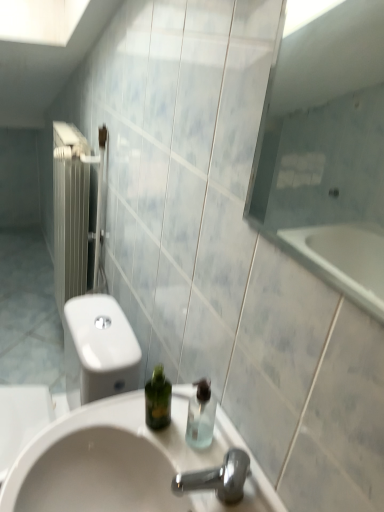
Question: Is white glossy sink at center at the right side of transparent glass shower at right?

Choices:
 (A) yes
 (B) no

Answer: (B)

Question: From a real-world perspective, does white glossy sink at center stand above transparent glass shower at right?

Choices:
 (A) yes
 (B) no

Answer: (B)

Question: Is white glossy sink at center aimed at transparent glass shower at right?

Choices:
 (A) yes
 (B) no

Answer: (B)

Question: Is transparent glass shower at right a part of white glossy sink at center?

Choices:
 (A) no
 (B) yes

Answer: (A)

Question: From the image's perspective, does white glossy sink at center appear lower than transparent glass shower at right?

Choices:
 (A) no
 (B) yes

Answer: (B)

Question: Is transparent plastic soap dispenser at center spatially inside white glossy sink at center, or outside of it?

Choices:
 (A) inside
 (B) outside

Answer: (B)

Question: Is transparent plastic soap dispenser at center to the left or to the right of white glossy sink at center in the image?

Choices:
 (A) right
 (B) left

Answer: (A)

Question: In terms of size, does transparent plastic soap dispenser at center appear bigger or smaller than white glossy sink at center?

Choices:
 (A) big
 (B) small

Answer: (B)

Question: From the image's perspective, relative to white glossy sink at center, is transparent plastic soap dispenser at center above or below?

Choices:
 (A) below
 (B) above

Answer: (B)

Question: From a real-world perspective, is white glossy sink at center positioned above or below transparent glass shower at right?

Choices:
 (A) below
 (B) above

Answer: (A)

Question: Is white glossy sink at center inside or outside of transparent glass shower at right?

Choices:
 (A) outside
 (B) inside

Answer: (A)

Question: From the image's perspective, is white glossy sink at center above or below transparent glass shower at right?

Choices:
 (A) above
 (B) below

Answer: (B)

Question: Considering their positions, is white glossy sink at center located in front of or behind transparent glass shower at right?

Choices:
 (A) front
 (B) behind

Answer: (B)

Question: From the image's perspective, relative to transparent plastic soap dispenser at center, is white glossy sink at center above or below?

Choices:
 (A) below
 (B) above

Answer: (A)

Question: Looking at their shapes, would you say white glossy sink at center is wider or thinner than transparent plastic soap dispenser at center?

Choices:
 (A) thin
 (B) wide

Answer: (B)